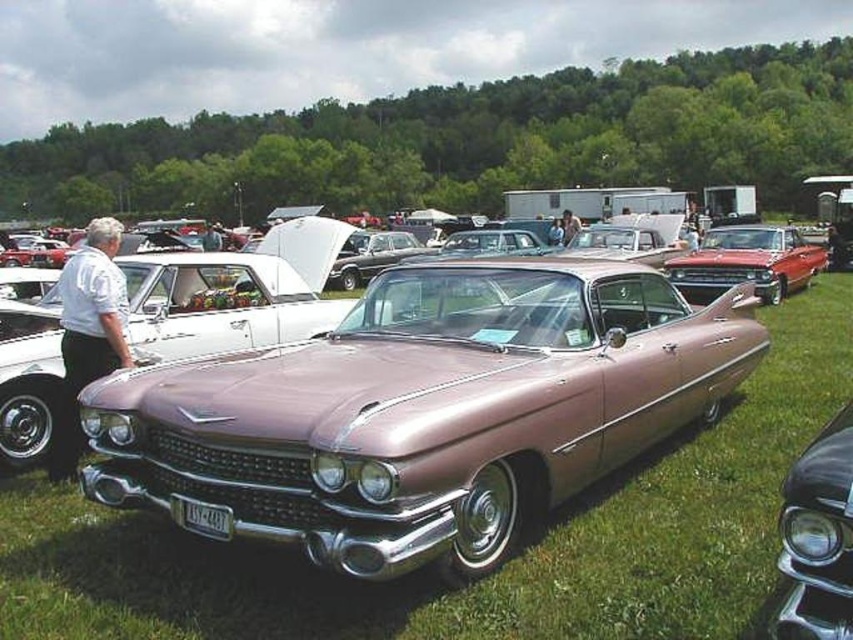
Who is positioned more to the right, white shirt at left or shiny red car at center?

From the viewer's perspective, shiny red car at center appears more on the right side.

Is white shirt at left to the left of shiny red car at center from the viewer's perspective?

Yes, white shirt at left is to the left of shiny red car at center.

Locate an element on the screen. This screenshot has width=853, height=640. white shirt at left is located at coordinates (88, 332).

Locate an element on the screen. This screenshot has height=640, width=853. white shirt at left is located at coordinates (88, 332).

Can you confirm if glossy black headlight at lower right is taller than white shirt at left?

In fact, glossy black headlight at lower right may be shorter than white shirt at left.

Does glossy black headlight at lower right have a lesser width compared to white shirt at left?

Yes.

Which is in front, point (842, 474) or point (120, 236)?

Point (842, 474) is more forward.

Image resolution: width=853 pixels, height=640 pixels. What are the coordinates of `glossy black headlight at lower right` in the screenshot? It's located at (817, 538).

Is metallic purple car at center thinner than shiny red car at center?

Yes, metallic purple car at center is thinner than shiny red car at center.

Who is taller, metallic purple car at center or shiny red car at center?

shiny red car at center

Does point (595, 472) come behind point (817, 246)?

No, (595, 472) is in front of (817, 246).

This screenshot has width=853, height=640. Find the location of `metallic purple car at center`. metallic purple car at center is located at coordinates (422, 410).